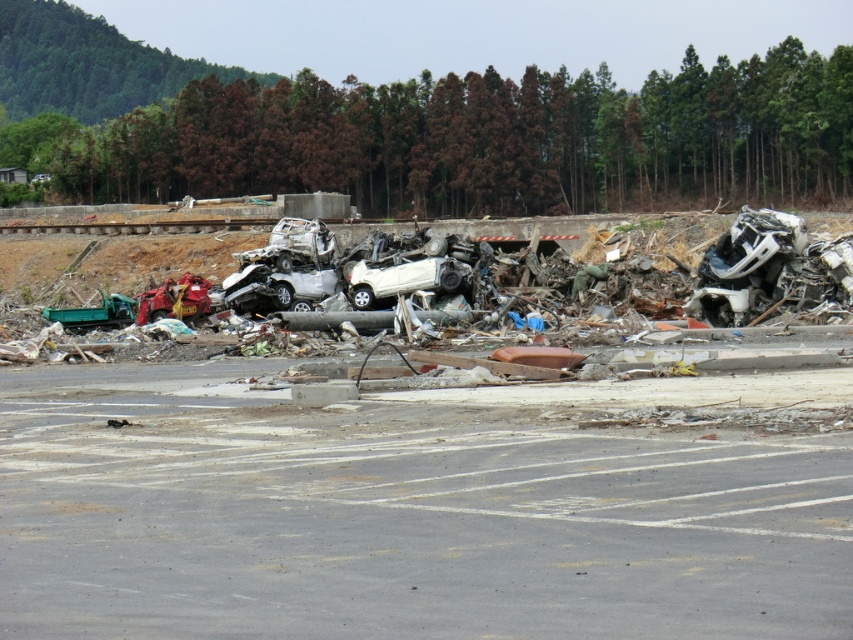
Between white plastic car at right and rusty metal car at center, which one appears on the right side from the viewer's perspective?

From the viewer's perspective, white plastic car at right appears more on the right side.

Is white plastic car at right positioned before rusty metal car at center?

Yes.

What do you see at coordinates (752, 243) in the screenshot?
I see `white plastic car at right` at bounding box center [752, 243].

The image size is (853, 640). What are the coordinates of `white plastic car at right` in the screenshot? It's located at (752, 243).

Can you confirm if white plastic car at right is positioned above metallic red motorcycle at left?

Yes, white plastic car at right is above metallic red motorcycle at left.

Can you confirm if white plastic car at right is smaller than metallic red motorcycle at left?

Yes.

Who is more forward, (734, 253) or (173, 316)?

Positioned in front is point (734, 253).

Where is `white plastic car at right`? white plastic car at right is located at coordinates (752, 243).

Who is more forward, [763,540] or [732,269]?

Point [763,540] is in front.

Is the position of gray asphalt parking lot at lower center less distant than that of white plastic car at right?

Yes, gray asphalt parking lot at lower center is closer to the viewer.

Is point (439, 470) more distant than point (741, 228)?

No, (439, 470) is closer to viewer.

Where is `gray asphalt parking lot at lower center`? gray asphalt parking lot at lower center is located at coordinates (397, 520).